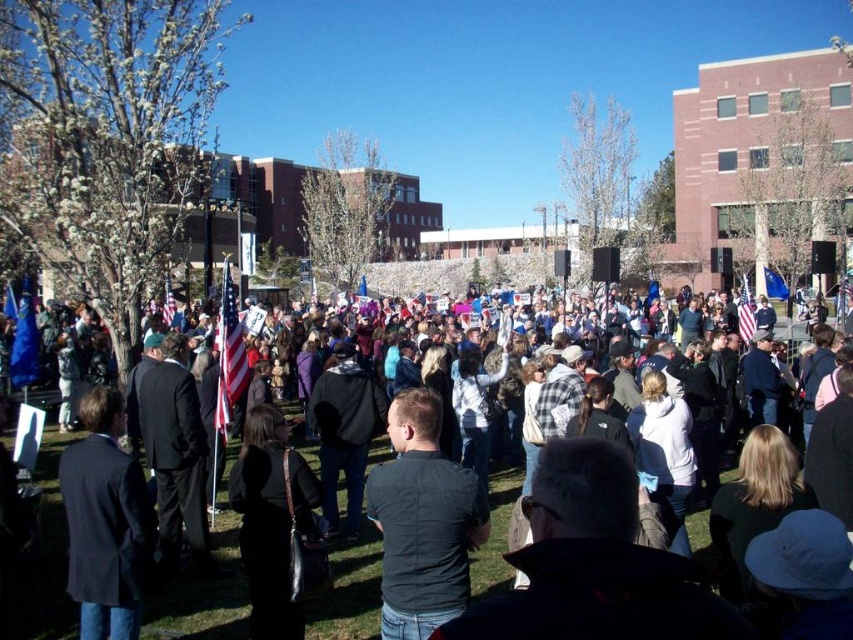
Is point (434, 451) farther from camera compared to point (228, 269)?

No.

Is point (387, 538) positioned after point (225, 353)?

No, it is not.

Where is `dark gray fabric shirt at center`? This screenshot has width=853, height=640. dark gray fabric shirt at center is located at coordinates [x=422, y=522].

Between white cotton shirt at center and american flag at center, which one appears on the right side from the viewer's perspective?

white cotton shirt at center is more to the right.

Is white cotton shirt at center to the left of american flag at center from the viewer's perspective?

Incorrect, white cotton shirt at center is not on the left side of american flag at center.

Who is more distant from viewer, (239, 566) or (242, 365)?

The point (242, 365) is behind.

Identify the location of white cotton shirt at center. This screenshot has width=853, height=640. (204, 588).

Can you confirm if white cotton shirt at center is positioned to the left of dark gray fabric shirt at center?

Yes, white cotton shirt at center is to the left of dark gray fabric shirt at center.

Which is above, white cotton shirt at center or dark gray fabric shirt at center?

white cotton shirt at center

Locate an element on the screen. The image size is (853, 640). white cotton shirt at center is located at coordinates tap(204, 588).